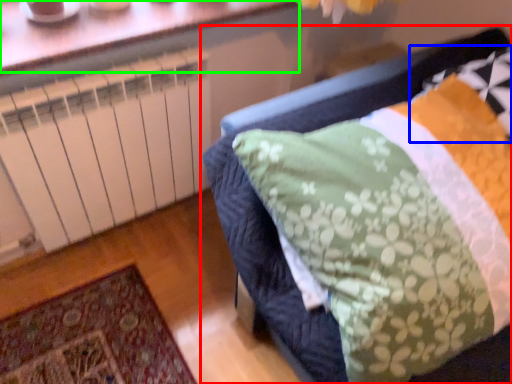
Question: Based on their relative distances, which object is nearer to furniture (highlighted by a red box)? Choose from pillow (highlighted by a blue box) and window (highlighted by a green box).

Choices:
 (A) pillow
 (B) window

Answer: (A)